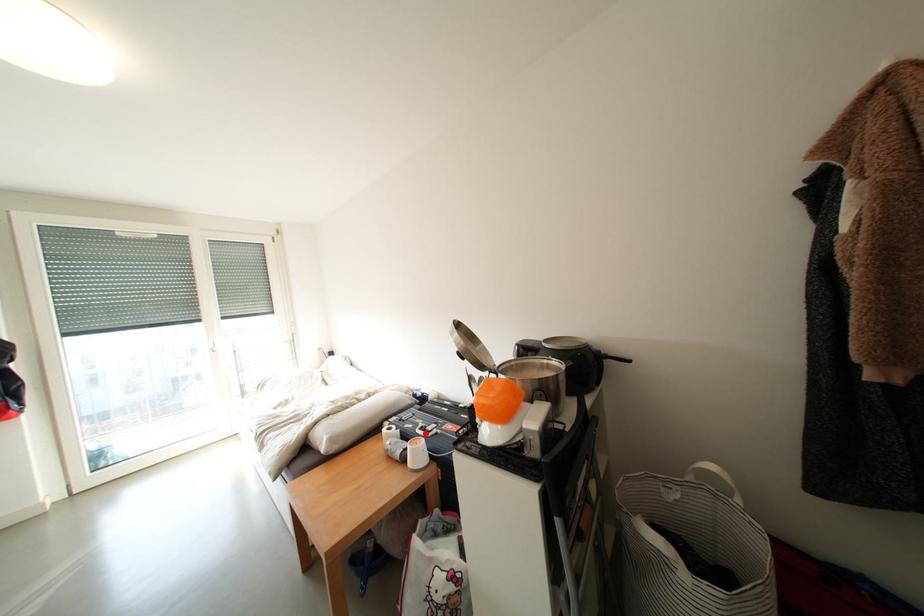
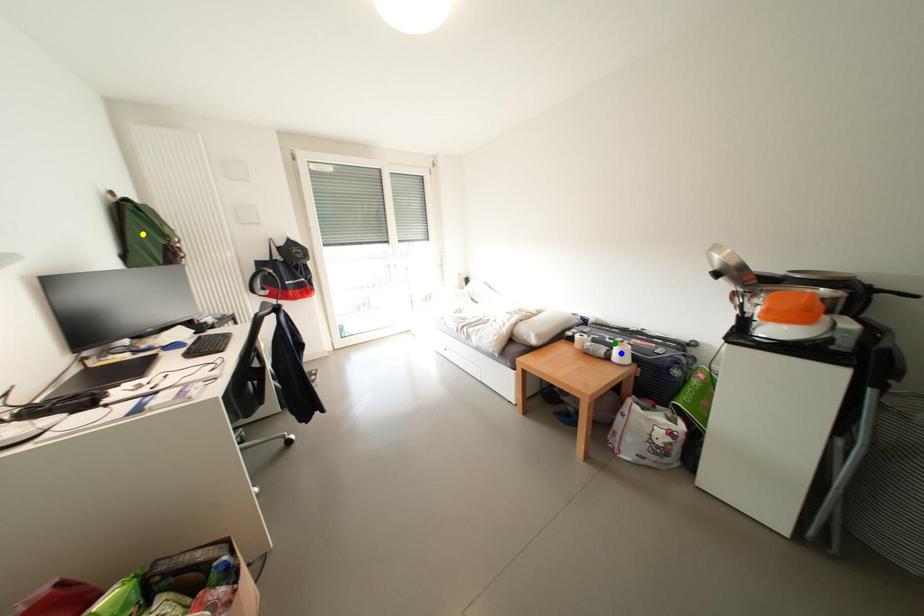
Question: I am providing you with two images of the same scene from different viewpoints. A red point is marked on the first image. You are given multiple points on the second image. Can you choose the point in image 2 that corresponds to the point in image 1?

Choices:
 (A) green point
 (B) blue point
 (C) yellow point

Answer: (A)